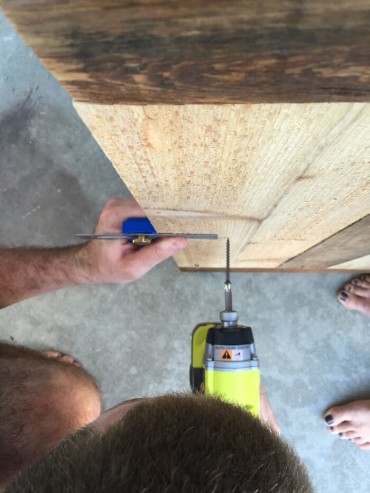
Locate an element on the screen. The image size is (370, 493). wood board is located at coordinates (244, 146).